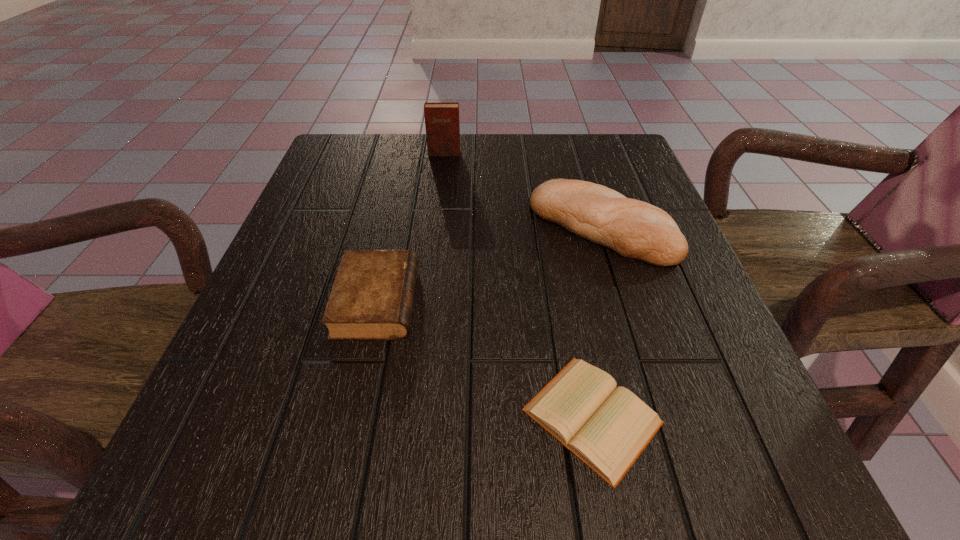
Locate an element on the screen. The height and width of the screenshot is (540, 960). vacant space that satisfies the following two spatial constraints: 1. on the front cover of the tallest diary; 2. on the spine side of the third tallest object is located at coordinates (427, 301).

This screenshot has height=540, width=960. I want to click on free space that satisfies the following two spatial constraints: 1. on the front cover of the third shortest object; 2. on the right side of the farthest object, so click(x=436, y=227).

Identify the location of free space that satisfies the following two spatial constraints: 1. on the spine side of the shortest object; 2. on the left side of the second tallest diary. [x=352, y=416].